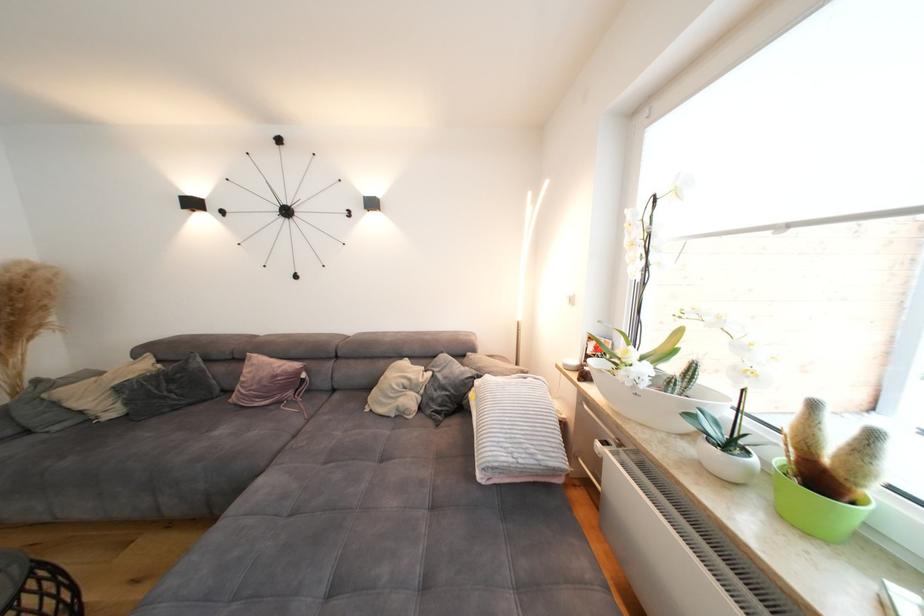
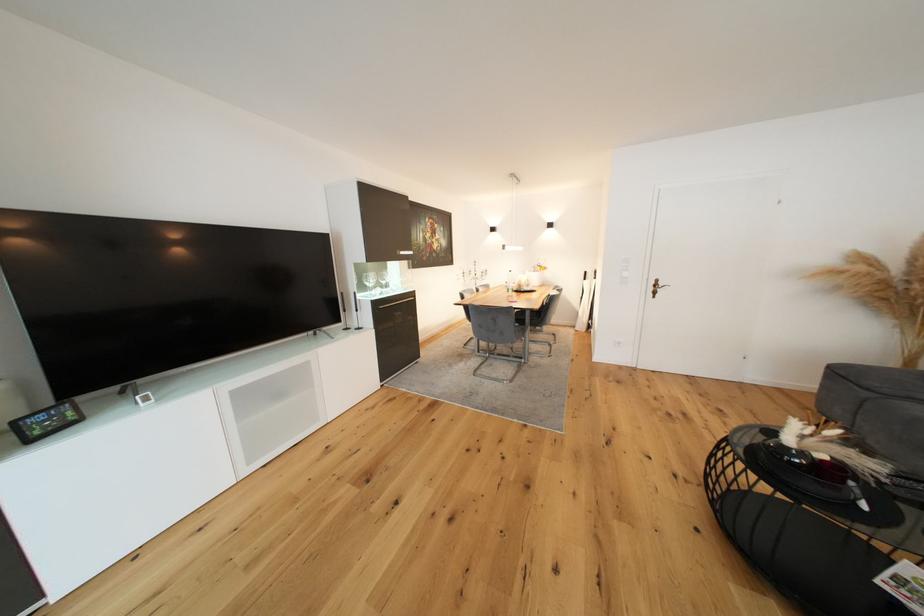
Based on the continuous images, in which direction is the camera rotating?

The camera rotated toward left-down.